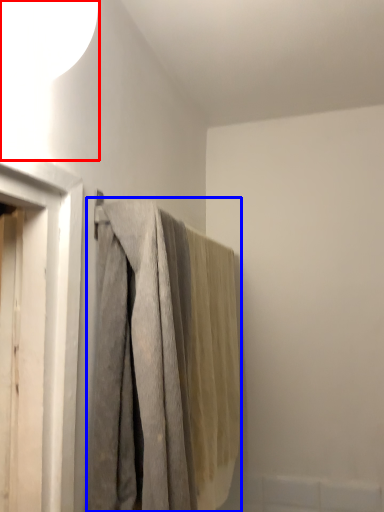
Question: Which point is closer to the camera, lamp (highlighted by a red box) or curtain (highlighted by a blue box)?

Choices:
 (A) lamp
 (B) curtain

Answer: (A)